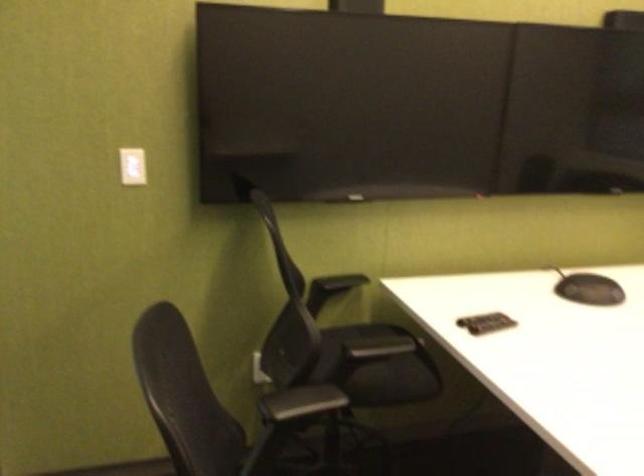
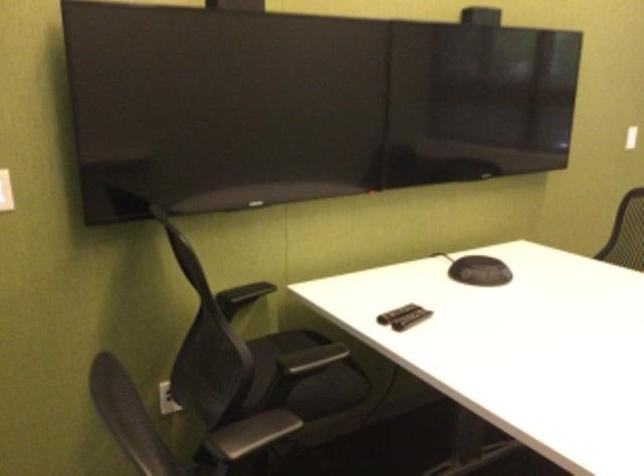
Find the pixel in the second image that matches point 478,318 in the first image.

(395, 313)